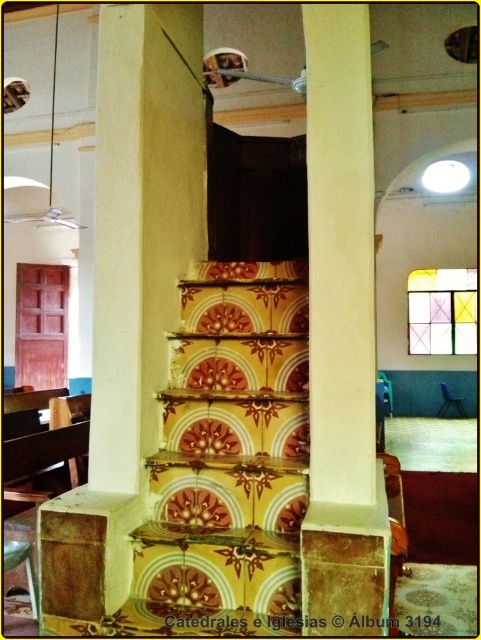
You are standing at the entrance of the church and want to reach the choir loft. The yellow tile stairs at center are your only path. Can you estimate the coordinates where the stairs begin?

The yellow tile stairs at center begin at coordinates point (228, 460).